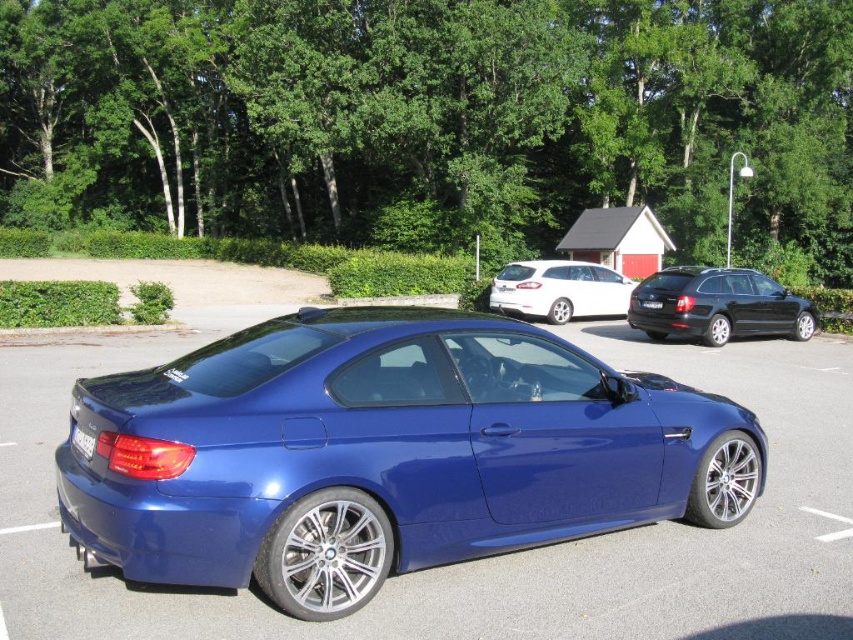
Question: Is black metallic wagon at right smaller than blue metallic license plate at center?

Choices:
 (A) no
 (B) yes

Answer: (A)

Question: Is black metallic wagon at right closer to camera compared to black plastic license plate at rear?

Choices:
 (A) no
 (B) yes

Answer: (A)

Question: Can you confirm if metallic blue car at center is positioned to the right of black metallic wagon at right?

Choices:
 (A) yes
 (B) no

Answer: (B)

Question: Which of the following is the farthest from the observer?

Choices:
 (A) (328, 586)
 (B) (503, 300)
 (C) (680, 307)
 (D) (90, 456)

Answer: (B)

Question: Estimate the real-world distances between objects in this image. Which object is farther from the blue metallic license plate at center?

Choices:
 (A) white matte wagon at center
 (B) black plastic license plate at rear
 (C) metallic blue car at center

Answer: (B)

Question: Based on their relative distances, which object is farther from the white matte wagon at center?

Choices:
 (A) metallic blue car at center
 (B) blue metallic license plate at center

Answer: (A)